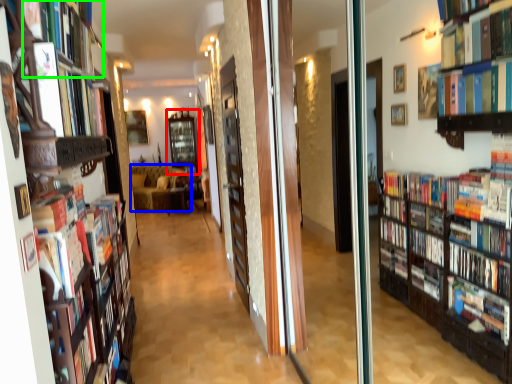
Question: Estimate the real-world distances between objects in this image. Which object is closer to shelf (highlighted by a red box), couch (highlighted by a blue box) or book (highlighted by a green box)?

Choices:
 (A) couch
 (B) book

Answer: (A)